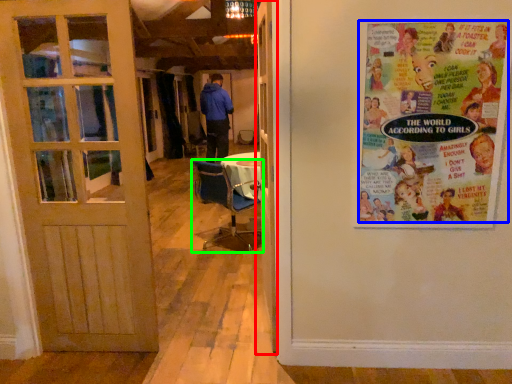
Question: Based on their relative distances, which object is nearer to door (highlighted by a red box)? Choose from poster (highlighted by a blue box) and chair (highlighted by a green box).

Choices:
 (A) poster
 (B) chair

Answer: (A)